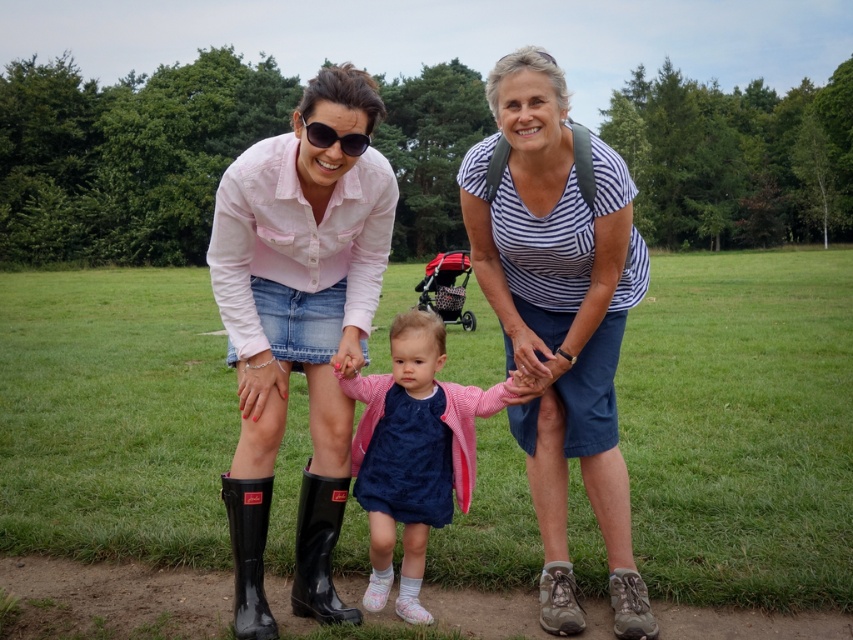
Based on the photo, you are standing in the grassy field and want to find the pink fabric dress at center. Based on the coordinates provided, in which direction should you move relative to the two adults to locate it?

The pink fabric dress at center is located at coordinates point (x=413, y=452). Since the adult on the left is described as being on the left side of the image and the adult on the right is on the right side, the dress is positioned toward the right side of the image. Therefore, you should move toward the adult on the right to find the pink fabric dress at center.

You are a photographer trying to capture a photo of the scene. You notice the pink fabric dress at center and the rubber boots at lower center. Since you want to ensure both are clearly visible in the shot, which object should you focus on first to ensure proper focus and sharpness?

The pink fabric dress at center should be focused on first because it has a larger size compared to the rubber boots at lower center, making it more prominent in the frame.